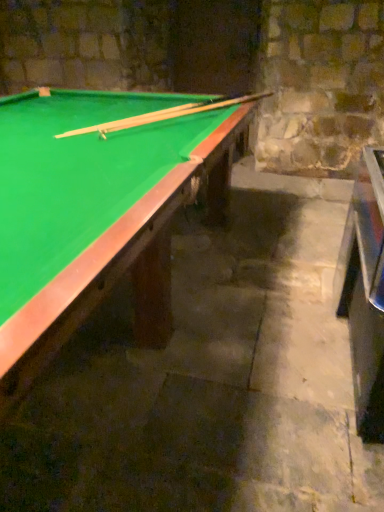
What are the coordinates of `free space that is to the left of wooden cue at upper center` in the screenshot? It's located at (80, 109).